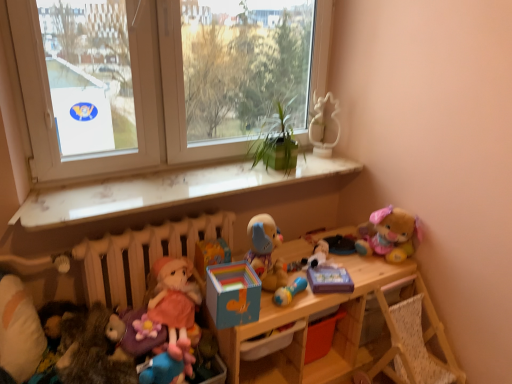
You are a GUI agent. You are given a task and a screenshot of the screen. Output one action in this format:
    pyautogui.click(x=<x>, y=<y>)
    Task: Click on the free region under fluffy plush bear at upper right, placed as the 7th toy when sorted from left to right (from a real-world perspective)
    Image resolution: width=512 pixels, height=384 pixels.
    Given the screenshot: What is the action you would take?
    pyautogui.click(x=376, y=259)